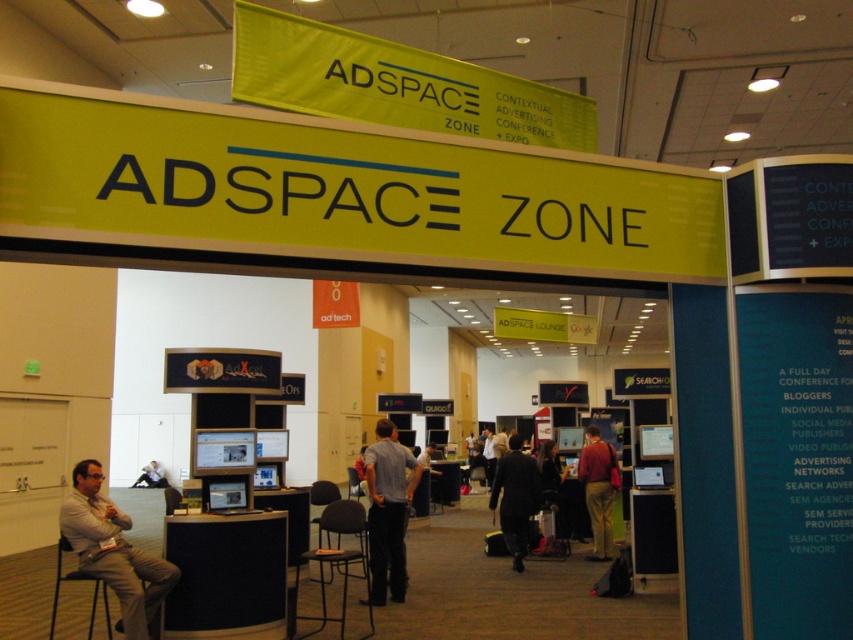
You are standing in the ADSPACE ZONE at the expo and need to reach a specific point. If you have to choose between moving to point A at coordinates point (x=74, y=496) and point B at coordinates point (x=152, y=461), which point is closer to your current position?

Point (x=74, y=496) is closer to your current position because it is closer to the camera than point (x=152, y=461).